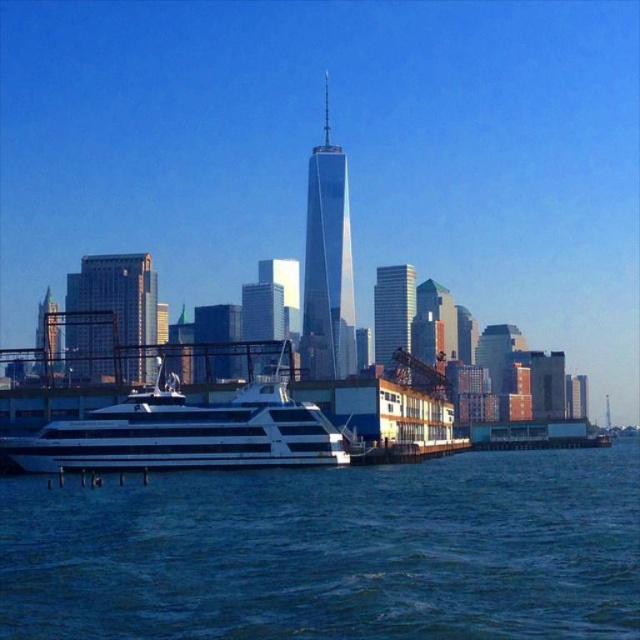
Between point (138, 422) and point (404, 300), which one is positioned in front?

Point (138, 422) is more forward.

Can you confirm if white glossy cruise ship at lower left is positioned above glassy reflective skyscraper at center?

Incorrect, white glossy cruise ship at lower left is not positioned above glassy reflective skyscraper at center.

The height and width of the screenshot is (640, 640). What do you see at coordinates (186, 432) in the screenshot?
I see `white glossy cruise ship at lower left` at bounding box center [186, 432].

Identify the location of white glossy cruise ship at lower left. (186, 432).

Which of these two, blue water at lower center or glassy reflective skyscraper at center, stands shorter?

With less height is blue water at lower center.

Can you confirm if blue water at lower center is positioned above glassy reflective skyscraper at center?

No, blue water at lower center is not above glassy reflective skyscraper at center.

Does point (176, 596) come behind point (392, 317)?

No, it is not.

What are the coordinates of `blue water at lower center` in the screenshot? It's located at (332, 552).

Is glassy steel skyscraper at center below shiny glass skyscraper at center?

Incorrect, glassy steel skyscraper at center is not positioned below shiny glass skyscraper at center.

Does glassy steel skyscraper at center have a greater width compared to shiny glass skyscraper at center?

Yes, glassy steel skyscraper at center is wider than shiny glass skyscraper at center.

At what (x,y) coordinates should I click in order to perform the action: click on glassy steel skyscraper at center. Please return your answer as a coordinate pair (x, y). Looking at the image, I should click on (326, 264).